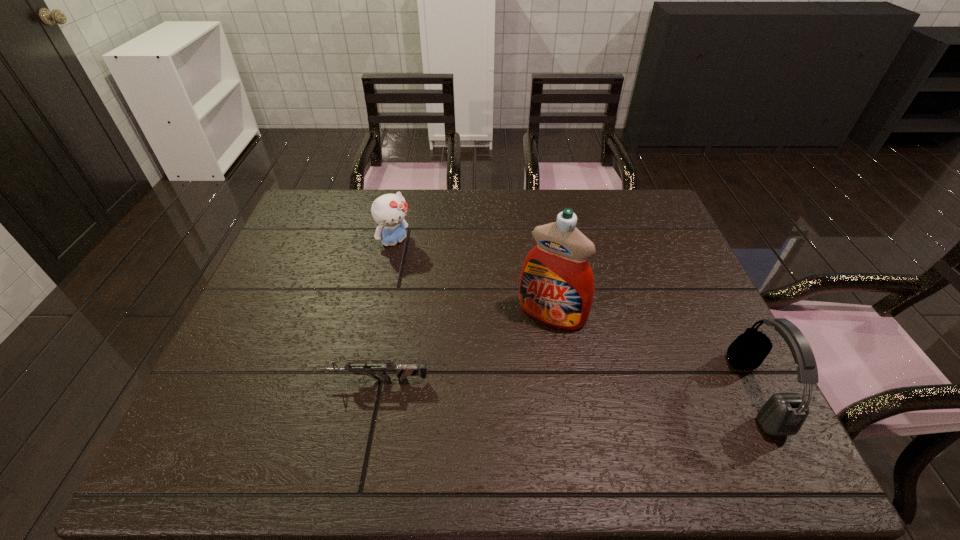
Image resolution: width=960 pixels, height=540 pixels. What are the coordinates of `free spot on the desktop that is between the shortest object and the third shortest object and is positioned on the front-facing side of the farthest object` in the screenshot? It's located at (540, 386).

You are a GUI agent. You are given a task and a screenshot of the screen. Output one action in this format:
    pyautogui.click(x=<x>, y=<y>)
    Task: Click on the free space on the desktop that is between the gun and the rightmost object and is positioned on the front surface of the second farthest object
    The height and width of the screenshot is (540, 960).
    Given the screenshot: What is the action you would take?
    pyautogui.click(x=512, y=384)